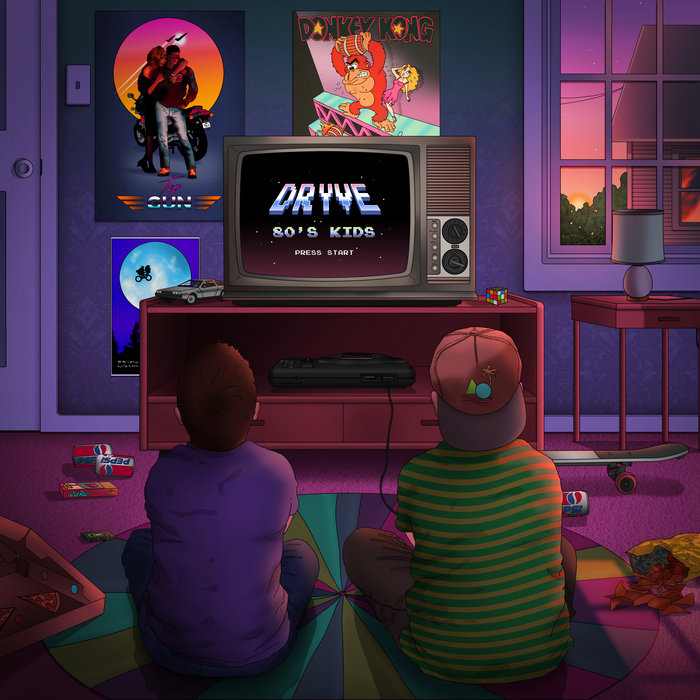
The height and width of the screenshot is (700, 700). Find the location of `t.v`. t.v is located at coordinates (395, 194).